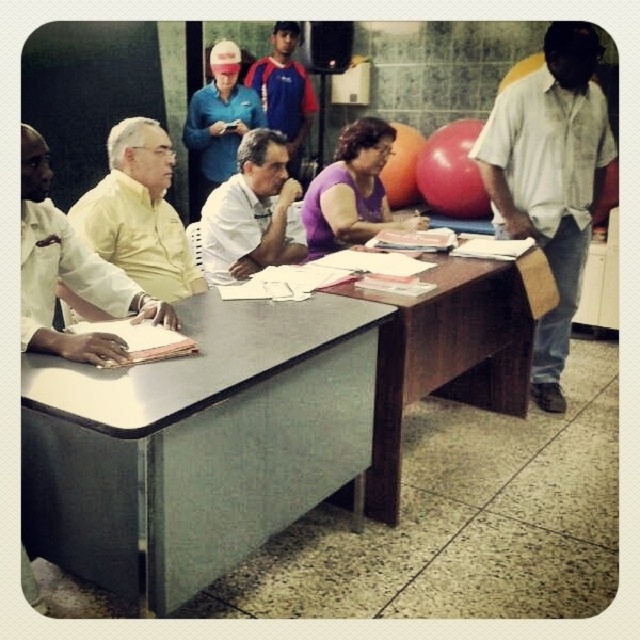
Which is below, white matte shirt at center or matte blue shirt at upper center?

white matte shirt at center is lower down.

Is white matte shirt at center positioned in front of matte blue shirt at upper center?

Yes, it is.

What do you see at coordinates (252, 212) in the screenshot?
I see `white matte shirt at center` at bounding box center [252, 212].

The height and width of the screenshot is (640, 640). Identify the location of white matte shirt at center. (252, 212).

Can you confirm if metallic gray table at left is wider than blue fabric shirt at upper center?

Yes.

Between metallic gray table at left and blue fabric shirt at upper center, which one appears on the left side from the viewer's perspective?

blue fabric shirt at upper center

Is point (264, 344) more distant than point (301, 109)?

No, (264, 344) is in front of (301, 109).

Where is `metallic gray table at left`? metallic gray table at left is located at coordinates (196, 444).

Is white matte shirt at center shorter than blue fabric shirt at upper center?

Yes, white matte shirt at center is shorter than blue fabric shirt at upper center.

Is point (301, 234) positioned before point (304, 132)?

Yes, point (301, 234) is closer to viewer.

Locate an element on the screen. The image size is (640, 640). white matte shirt at center is located at coordinates (252, 212).